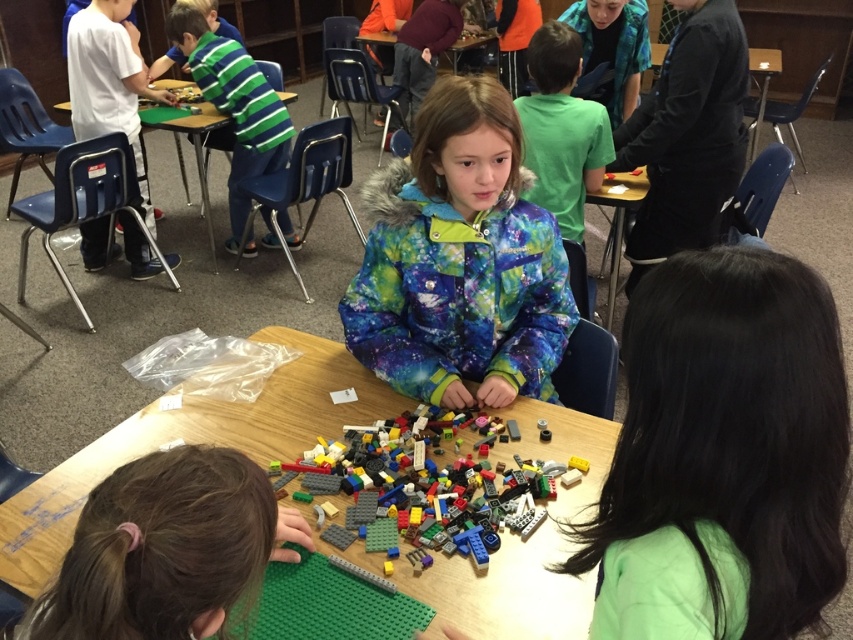
Can you confirm if black hair at center is shorter than blue plastic chair at left?

Indeed, black hair at center has a lesser height compared to blue plastic chair at left.

I want to click on black hair at center, so click(733, 433).

Describe the element at coordinates (733, 433) in the screenshot. This screenshot has height=640, width=853. I see `black hair at center` at that location.

This screenshot has height=640, width=853. I want to click on black hair at center, so click(733, 433).

In the scene shown: Between blue plastic chair at left and black plastic table at upper right, which one appears on the right side from the viewer's perspective?

Positioned to the right is black plastic table at upper right.

Who is more forward, (279, 99) or (653, 67)?

Positioned in front is point (279, 99).

Identify the location of blue plastic chair at left. (196, 150).

Is green matte lego at lower left taller than green striped shirt at left?

Incorrect, green matte lego at lower left's height is not larger of green striped shirt at left's.

Looking at this image, is green matte lego at lower left thinner than green striped shirt at left?

Yes.

The height and width of the screenshot is (640, 853). Find the location of `green matte lego at lower left`. green matte lego at lower left is located at coordinates (167, 548).